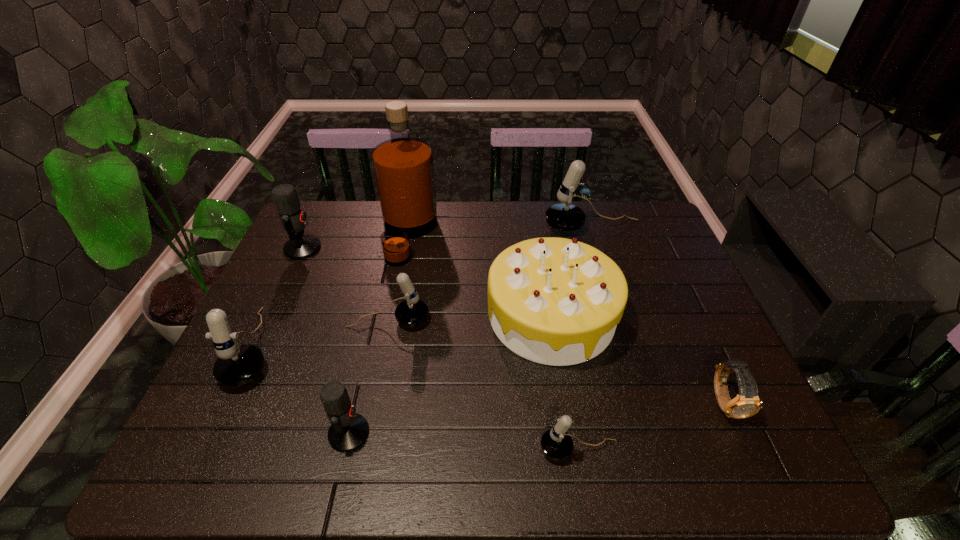
The image size is (960, 540). What are the coordinates of `free point between the farthest white microphone and the left red microphone` in the screenshot? It's located at (447, 238).

The width and height of the screenshot is (960, 540). Find the location of `unoccupied position between the farther red microphone and the birthday cake`. unoccupied position between the farther red microphone and the birthday cake is located at coordinates (427, 282).

Find the location of a particular element. This screenshot has width=960, height=540. object that stands as the fifth closest to the farthest white microphone is located at coordinates (556, 443).

Locate which object is the sixth closest to the tallest object. Please provide its 2D coordinates. Your answer should be formatted as a tuple, i.e. [(x, y)], where the tuple contains the x and y coordinates of a point satisfying the conditions above.

[(349, 430)]

At what (x,y) coordinates should I click in order to perform the action: click on microphone that is the third closest to the farther red microphone. Please return your answer as a coordinate pair (x, y). The image size is (960, 540). Looking at the image, I should click on (349, 430).

The height and width of the screenshot is (540, 960). In order to click on the fifth closest microphone to the second biggest white microphone in this screenshot , I will do `click(565, 217)`.

The image size is (960, 540). Identify the location of white microphone that is the closest to the smallest white microphone. (412, 312).

Identify which white microphone is located as the third nearest to the third white microphone from right to left. Please provide its 2D coordinates. Your answer should be formatted as a tuple, i.e. [(x, y)], where the tuple contains the x and y coordinates of a point satisfying the conditions above.

[(565, 217)]

You are a GUI agent. You are given a task and a screenshot of the screen. Output one action in this format:
    pyautogui.click(x=<x>, y=<y>)
    Task: Click on the free space that satisfies the following two spatial constraints: 1. on the side of the smaller red microphone with the red ring; 2. on the right side of the shortest microphone
    This screenshot has width=960, height=540.
    Given the screenshot: What is the action you would take?
    pyautogui.click(x=346, y=449)

Image resolution: width=960 pixels, height=540 pixels. What are the coordinates of `vacant position in the image that satisfies the following two spatial constraints: 1. on the front side of the nearest white microphone; 2. on the left side of the birthday cake` in the screenshot? It's located at (572, 449).